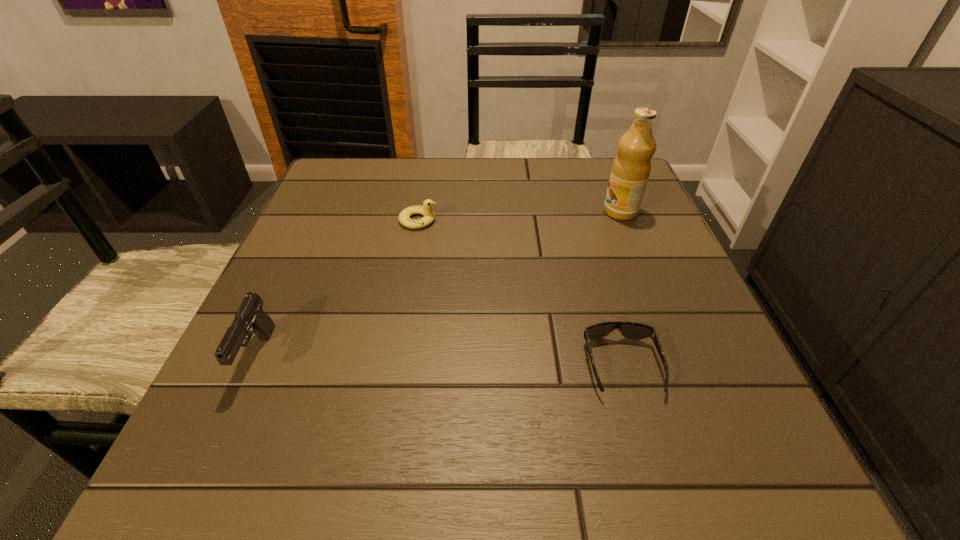
Where is `vacant space located on the face of the third object from right to left`? vacant space located on the face of the third object from right to left is located at coordinates point(550,220).

At what (x,y) coordinates should I click in order to perform the action: click on free region located on the front-facing side of the shortest object. Please return your answer as a coordinate pair (x, y). Image resolution: width=960 pixels, height=540 pixels. Looking at the image, I should click on tap(642, 438).

The width and height of the screenshot is (960, 540). Identify the location of object that is positioned at the far edge. (631, 168).

In order to click on object at the left edge in this screenshot , I will do click(250, 318).

Image resolution: width=960 pixels, height=540 pixels. What are the coordinates of `olive oil present at the right edge` in the screenshot? It's located at (631, 168).

Where is `sunglasses present at the right edge`? This screenshot has width=960, height=540. sunglasses present at the right edge is located at coordinates (632, 330).

The width and height of the screenshot is (960, 540). Find the location of `object at the far right corner`. object at the far right corner is located at coordinates (631, 168).

The width and height of the screenshot is (960, 540). I want to click on vacant space at the far edge of the desktop, so click(480, 176).

The image size is (960, 540). In the image, there is a desktop. In order to click on vacant space at the near edge in this screenshot , I will do `click(506, 438)`.

Locate an element on the screen. This screenshot has height=540, width=960. free region at the left edge of the desktop is located at coordinates (323, 332).